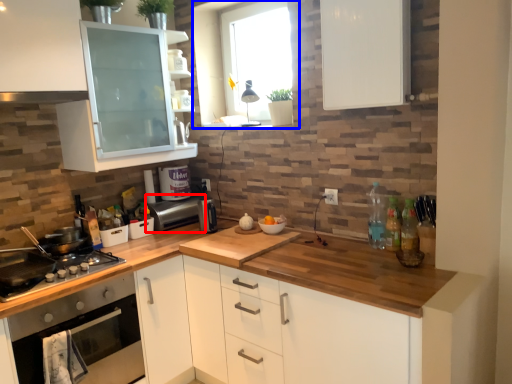
Question: Which of the following is the closest to the observer, appliance (highlighted by a red box) or window (highlighted by a blue box)?

Choices:
 (A) appliance
 (B) window

Answer: (B)